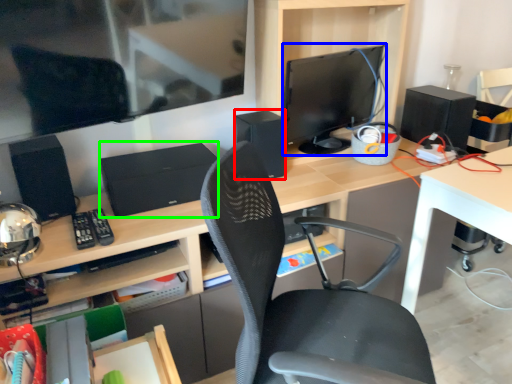
Question: Which object is the farthest from speaker (highlighted by a red box)? Choose among these: computer monitor (highlighted by a blue box) or computer (highlighted by a green box).

Choices:
 (A) computer monitor
 (B) computer

Answer: (B)